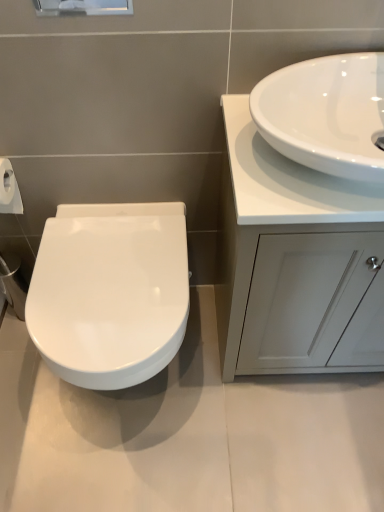
Where is `vacant point to the right of white glossy toilet at left`? vacant point to the right of white glossy toilet at left is located at coordinates (248, 408).